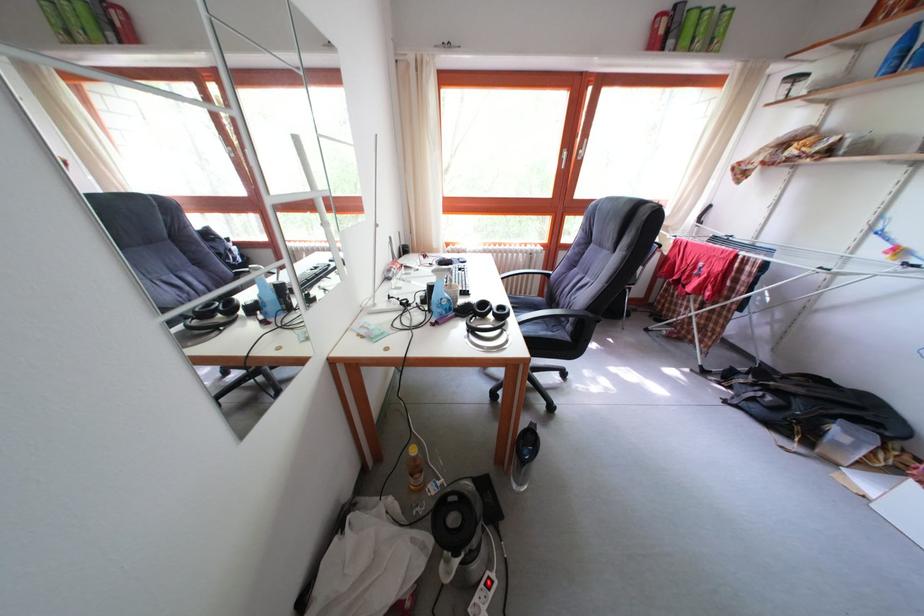
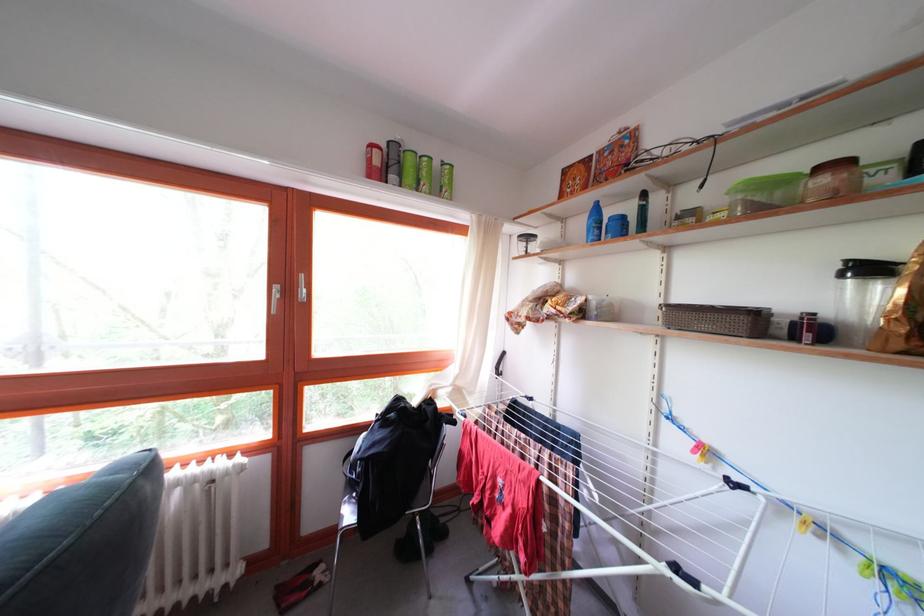
In the second image, find the point that corresponds to point 700,47 in the first image.

(428, 187)